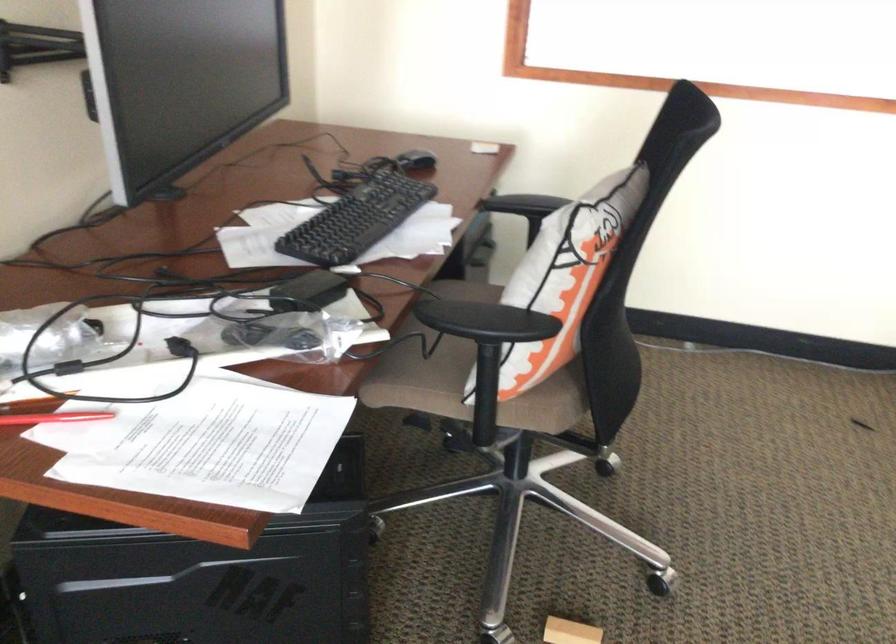
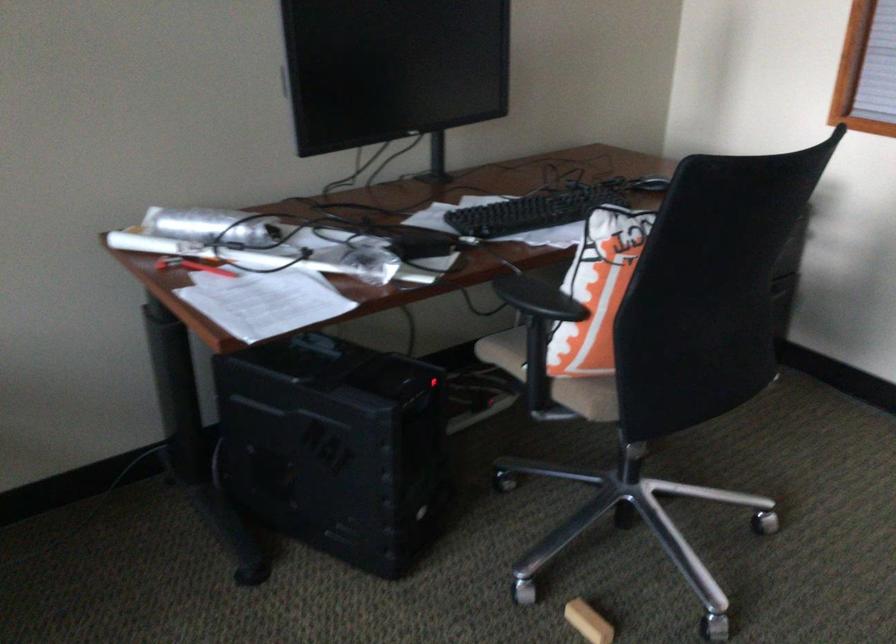
The point at [369,218] is marked in the first image. Where is the corresponding point in the second image?

(532, 211)